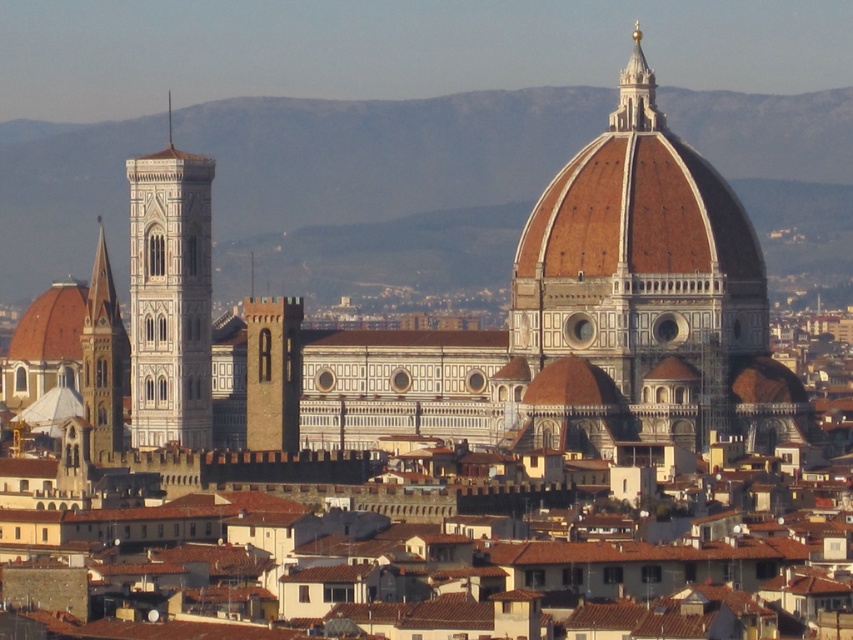
Question: Which point is farther to the camera?

Choices:
 (A) (248, 403)
 (B) (111, 372)
 (C) (204, 448)
 (D) (699, 323)

Answer: (C)

Question: From the image, what is the correct spatial relationship of white stone tower at left in relation to gold metallic spire at upper center?

Choices:
 (A) below
 (B) above

Answer: (A)

Question: Which point appears closest to the camera in this image?

Choices:
 (A) (549, 192)
 (B) (170, 424)
 (C) (128, 342)

Answer: (A)

Question: Is white marble dome at center positioned in front of golden stone tower at left?

Choices:
 (A) no
 (B) yes

Answer: (B)

Question: Does white marble dome at center appear under brown stone tower at center?

Choices:
 (A) no
 (B) yes

Answer: (A)

Question: Which is nearer to the brown stone tower at center?

Choices:
 (A) golden stone tower at left
 (B) white stone tower at left
 (C) white marble dome at center

Answer: (B)